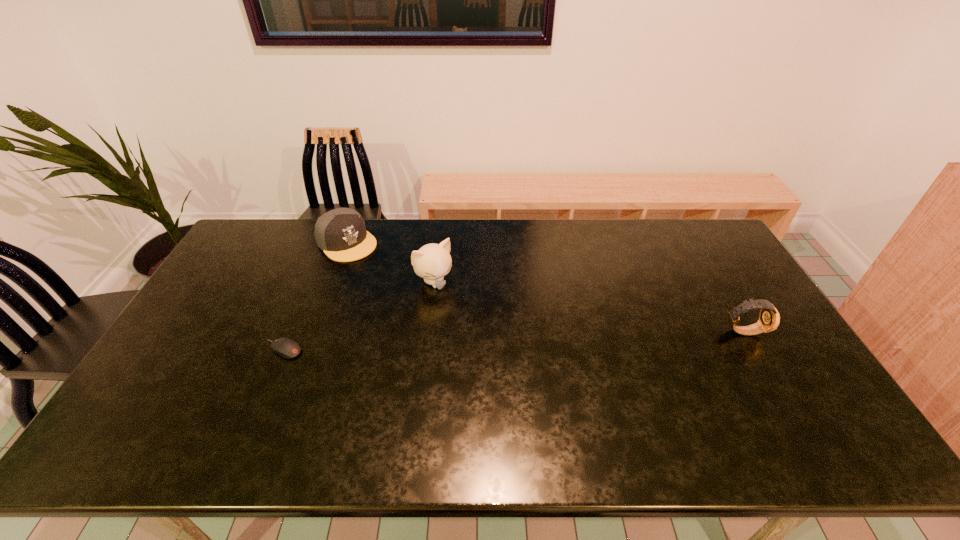
Identify the location of free space on the desktop that is between the computer mouse and the rightmost object and is positioned on the face of the third nearest object. The width and height of the screenshot is (960, 540). (484, 342).

At what (x,y) coordinates should I click in order to perform the action: click on vacant space on the desktop that is between the shortest object and the watch and is positioned on the front-facing side of the cap. Please return your answer as a coordinate pair (x, y). This screenshot has height=540, width=960. Looking at the image, I should click on (456, 343).